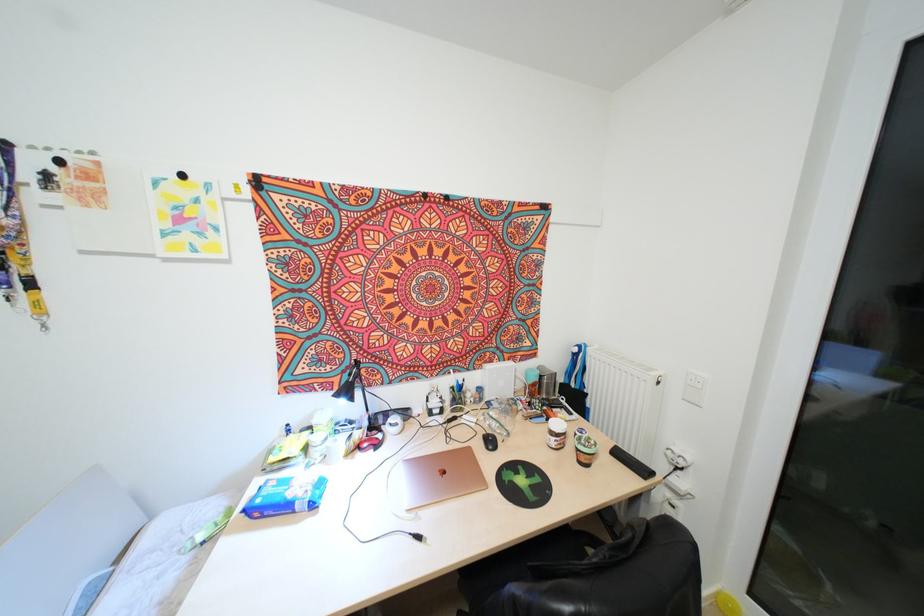
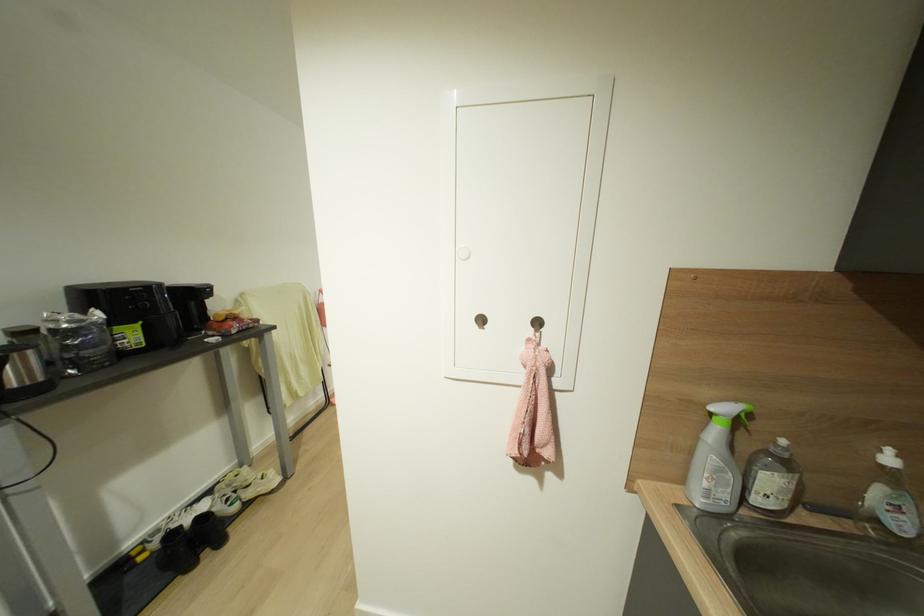
Question: I am providing you with two images of the same scene from different viewpoints. Please identify which objects are invisible in image2.

Choices:
 (A) black binder clip
 (B) black shoe
 (C) silver electric kettle
 (D) small orange box

Answer: (A)